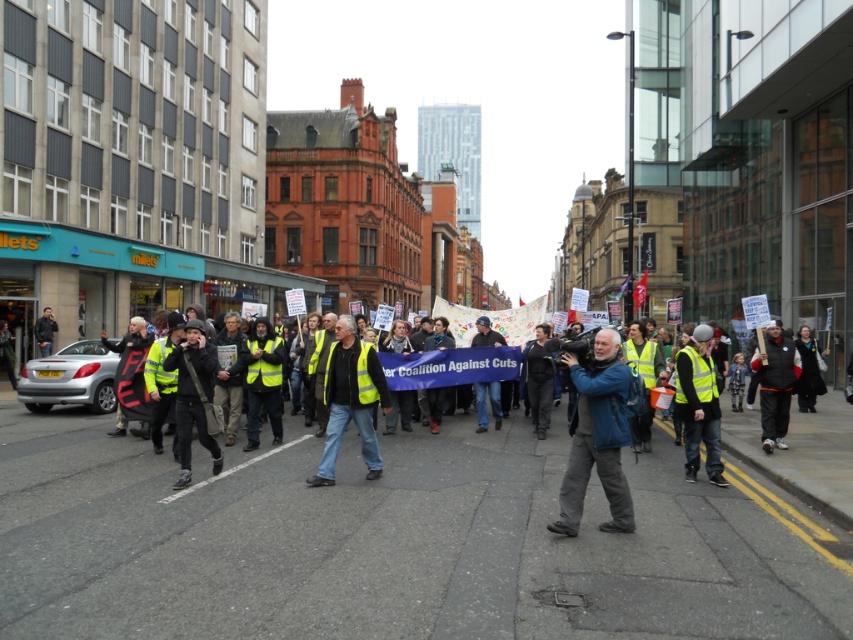
Question: Which of the following is the closest to the observer?

Choices:
 (A) (349, 419)
 (B) (572, 422)
 (C) (767, 387)

Answer: (C)

Question: Which object is farther from the camera taking this photo?

Choices:
 (A) dark gray fleece jacket at right
 (B) yellow reflective vest at center
 (C) blue fabric camera at center

Answer: (A)

Question: Can you confirm if yellow reflective vest at center is thinner than dark gray fleece jacket at right?

Choices:
 (A) yes
 (B) no

Answer: (B)

Question: Considering the real-world distances, which object is farthest from the dark gray fleece jacket at right?

Choices:
 (A) blue fabric camera at center
 (B) yellow reflective vest at center

Answer: (B)

Question: Is the position of blue fabric camera at center more distant than that of yellow reflective vest at center?

Choices:
 (A) yes
 (B) no

Answer: (B)

Question: Is blue fabric camera at center to the left of yellow reflective vest at center from the viewer's perspective?

Choices:
 (A) no
 (B) yes

Answer: (A)